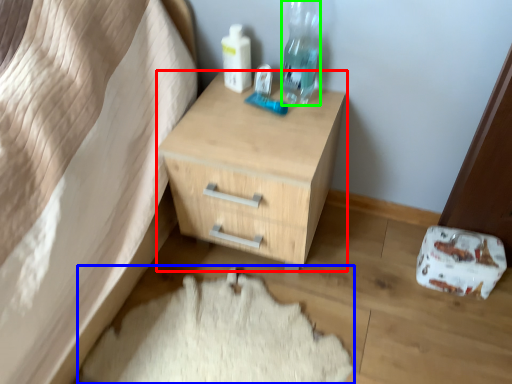
Question: Considering the real-world distances, which object is closest to chest of drawers (highlighted by a red box)? sheet (highlighted by a blue box) or bottle (highlighted by a green box).

Choices:
 (A) sheet
 (B) bottle

Answer: (B)